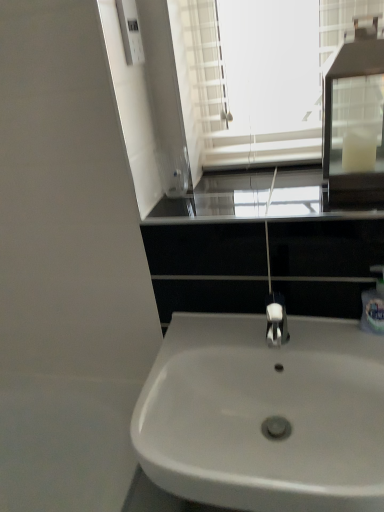
The width and height of the screenshot is (384, 512). Describe the element at coordinates (265, 415) in the screenshot. I see `white glossy sink at center` at that location.

Locate an element on the screen. Image resolution: width=384 pixels, height=512 pixels. white plastic soap dispenser at right is located at coordinates (374, 304).

This screenshot has width=384, height=512. What do you see at coordinates (374, 304) in the screenshot?
I see `white plastic soap dispenser at right` at bounding box center [374, 304].

The width and height of the screenshot is (384, 512). In order to click on black glass window sill at center in this screenshot , I will do `click(211, 207)`.

Where is `white glossy sink at center`? white glossy sink at center is located at coordinates (265, 415).

From a real-world perspective, is white glass medicine cabinet at upper right located higher than white plastic soap dispenser at right?

Yes, from a real-world perspective, white glass medicine cabinet at upper right is above white plastic soap dispenser at right.

Is white glass medicine cabinet at upper right facing towards white plastic soap dispenser at right?

No, white glass medicine cabinet at upper right does not turn towards white plastic soap dispenser at right.

Is white glass medicine cabinet at upper right completely or partially outside of white plastic soap dispenser at right?

Yes.

Is black glass window sill at center wider or thinner than white plastic soap dispenser at right?

Considering their sizes, black glass window sill at center looks broader than white plastic soap dispenser at right.

Considering their positions, is black glass window sill at center located in front of or behind white plastic soap dispenser at right?

In the image, black glass window sill at center appears in front of white plastic soap dispenser at right.

Could you tell me if black glass window sill at center is turned towards white plastic soap dispenser at right?

No, black glass window sill at center does not turn towards white plastic soap dispenser at right.

From a real-world perspective, which object stands above the other?

white plastic soap dispenser at right, from a real-world perspective.

This screenshot has height=512, width=384. I want to click on sink that appears in front of the white plastic soap dispenser at right, so click(x=265, y=415).

Which object is positioned more to the right, white plastic soap dispenser at right or white glossy sink at center?

white plastic soap dispenser at right is more to the right.

Which is behind, white plastic soap dispenser at right or white glossy sink at center?

white plastic soap dispenser at right.

Considering the positions of objects white plastic soap dispenser at right and white glass medicine cabinet at upper right in the image provided, who is behind, white plastic soap dispenser at right or white glass medicine cabinet at upper right?

white plastic soap dispenser at right is more distant.

From a real-world perspective, is white plastic soap dispenser at right below white glass medicine cabinet at upper right?

Yes, from a real-world perspective, white plastic soap dispenser at right is beneath white glass medicine cabinet at upper right.

Considering the positions of point (382, 314) and point (335, 113), is point (382, 314) closer or farther from the camera than point (335, 113)?

Point (382, 314) is closer to the camera than point (335, 113).

Considering the sizes of objects white plastic soap dispenser at right and white glass medicine cabinet at upper right in the image provided, who is wider, white plastic soap dispenser at right or white glass medicine cabinet at upper right?

white glass medicine cabinet at upper right.

From the picture: Is white glossy sink at center not within white plastic soap dispenser at right?

Yes.

Considering the relative sizes of white glossy sink at center and white plastic soap dispenser at right in the image provided, is white glossy sink at center wider than white plastic soap dispenser at right?

Indeed, white glossy sink at center has a greater width compared to white plastic soap dispenser at right.

From the image's perspective, is white glossy sink at center on white plastic soap dispenser at right?

Actually, white glossy sink at center appears below white plastic soap dispenser at right in the image.

Which is further, (275, 420) or (379, 322)?

The point (379, 322) is behind.

Where is `window sill on the left side of white glass medicine cabinet at upper right`? This screenshot has width=384, height=512. window sill on the left side of white glass medicine cabinet at upper right is located at coordinates (211, 207).

Is black glass window sill at center far from white glass medicine cabinet at upper right?

black glass window sill at center is near white glass medicine cabinet at upper right, not far away.

How far apart are black glass window sill at center and white glass medicine cabinet at upper right?

black glass window sill at center is 8.39 inches from white glass medicine cabinet at upper right.

From the image's perspective, which object appears higher, black glass window sill at center or white glass medicine cabinet at upper right?

white glass medicine cabinet at upper right appears higher in the image.

Does point (247, 330) lie behind point (360, 211)?

Yes, point (247, 330) is farther from viewer.

Is white glossy sink at center oriented towards black glass window sill at center?

No, white glossy sink at center is not aimed at black glass window sill at center.

Image resolution: width=384 pixels, height=512 pixels. I want to click on window sill on the right of the white glossy sink at center, so click(211, 207).

From a real-world perspective, which object rests below the other?

From a 3D spatial view, white glossy sink at center is below.

Identify the location of medicine cabinet above the white plastic soap dispenser at right (from the image's perspective). The width and height of the screenshot is (384, 512). (355, 119).

At what (x,y) coordinates should I click in order to perform the action: click on window sill that is in front of the white plastic soap dispenser at right. Please return your answer as a coordinate pair (x, y). This screenshot has width=384, height=512. Looking at the image, I should click on (211, 207).

Considering their positions, is white glossy sink at center positioned closer to white glass medicine cabinet at upper right than white plastic soap dispenser at right?

Among the two, white plastic soap dispenser at right is located nearer to white glass medicine cabinet at upper right.

Based on their spatial positions, is white plastic soap dispenser at right or black glass window sill at center further from white glossy sink at center?

black glass window sill at center is positioned further to the anchor white glossy sink at center.

Based on their spatial positions, is black glass window sill at center or white plastic soap dispenser at right further from white glass medicine cabinet at upper right?

white plastic soap dispenser at right lies further to white glass medicine cabinet at upper right than the other object.

From the image, which object appears to be nearer to black glass window sill at center, white glass medicine cabinet at upper right or white plastic soap dispenser at right?

A: Among the two, white glass medicine cabinet at upper right is located nearer to black glass window sill at center.

Looking at the image, which one is located closer to white glass medicine cabinet at upper right, black glass window sill at center or white glossy sink at center?

Based on the image, black glass window sill at center appears to be nearer to white glass medicine cabinet at upper right.

Looking at the image, which one is located further to white glossy sink at center, black glass window sill at center or white glass medicine cabinet at upper right?

white glass medicine cabinet at upper right is further to white glossy sink at center.

Based on their spatial positions, is white glossy sink at center or black glass window sill at center closer to white plastic soap dispenser at right?

black glass window sill at center is positioned closer to the anchor white plastic soap dispenser at right.

Based on their spatial positions, is white plastic soap dispenser at right or white glass medicine cabinet at upper right closer to black glass window sill at center?

Based on the image, white glass medicine cabinet at upper right appears to be nearer to black glass window sill at center.

What are the coordinates of `soap dispenser between white glass medicine cabinet at upper right and white glossy sink at center from top to bottom` in the screenshot? It's located at (374, 304).

Identify the location of window sill between white glass medicine cabinet at upper right and white glossy sink at center in the vertical direction. Image resolution: width=384 pixels, height=512 pixels. (211, 207).

Locate an element on the screen. The width and height of the screenshot is (384, 512). window sill between white glass medicine cabinet at upper right and white plastic soap dispenser at right vertically is located at coordinates (211, 207).

At what (x,y) coordinates should I click in order to perform the action: click on soap dispenser between black glass window sill at center and white glossy sink at center in the vertical direction. Please return your answer as a coordinate pair (x, y). The height and width of the screenshot is (512, 384). Looking at the image, I should click on (374, 304).